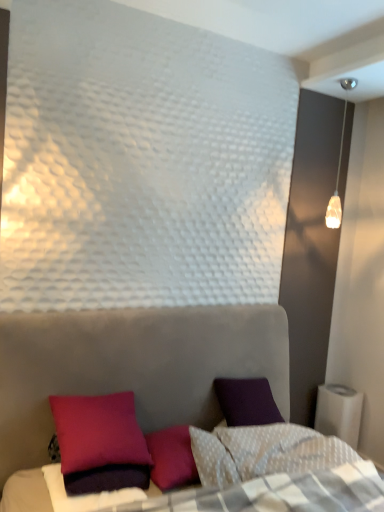
Question: From a real-world perspective, is translucent glass pendant light at upper right beneath velvet purple pillow at lower left?

Choices:
 (A) yes
 (B) no

Answer: (B)

Question: Is translucent glass pendant light at upper right taller than velvet purple pillow at lower left?

Choices:
 (A) yes
 (B) no

Answer: (A)

Question: Would you say velvet purple pillow at lower left is part of translucent glass pendant light at upper right's contents?

Choices:
 (A) yes
 (B) no

Answer: (B)

Question: Does translucent glass pendant light at upper right come in front of velvet purple pillow at lower left?

Choices:
 (A) yes
 (B) no

Answer: (B)

Question: Can you confirm if translucent glass pendant light at upper right is positioned to the right of velvet purple pillow at lower left?

Choices:
 (A) no
 (B) yes

Answer: (B)

Question: In the image, is purple matte pillow at lower left on the left side or the right side of velvet purple pillow at lower left?

Choices:
 (A) left
 (B) right

Answer: (A)

Question: From the image's perspective, is purple matte pillow at lower left located above or below velvet purple pillow at lower left?

Choices:
 (A) above
 (B) below

Answer: (B)

Question: Is purple matte pillow at lower left inside or outside of velvet purple pillow at lower left?

Choices:
 (A) outside
 (B) inside

Answer: (A)

Question: Looking at their shapes, would you say purple matte pillow at lower left is wider or thinner than velvet purple pillow at lower left?

Choices:
 (A) wide
 (B) thin

Answer: (B)

Question: Considering the positions of velvet purple pillow at lower left and purple matte pillow at lower left in the image, is velvet purple pillow at lower left taller or shorter than purple matte pillow at lower left?

Choices:
 (A) short
 (B) tall

Answer: (B)

Question: Is velvet purple pillow at lower left bigger or smaller than purple matte pillow at lower left?

Choices:
 (A) big
 (B) small

Answer: (A)

Question: In terms of width, does velvet purple pillow at lower left look wider or thinner when compared to purple matte pillow at lower left?

Choices:
 (A) thin
 (B) wide

Answer: (B)

Question: Is point (105, 454) closer or farther from the camera than point (56, 499)?

Choices:
 (A) farther
 (B) closer

Answer: (A)

Question: Looking at their shapes, would you say velvet purple pillow at lower left is wider or thinner than translucent glass pendant light at upper right?

Choices:
 (A) thin
 (B) wide

Answer: (B)

Question: In the image, is velvet purple pillow at lower left on the left side or the right side of translucent glass pendant light at upper right?

Choices:
 (A) left
 (B) right

Answer: (A)